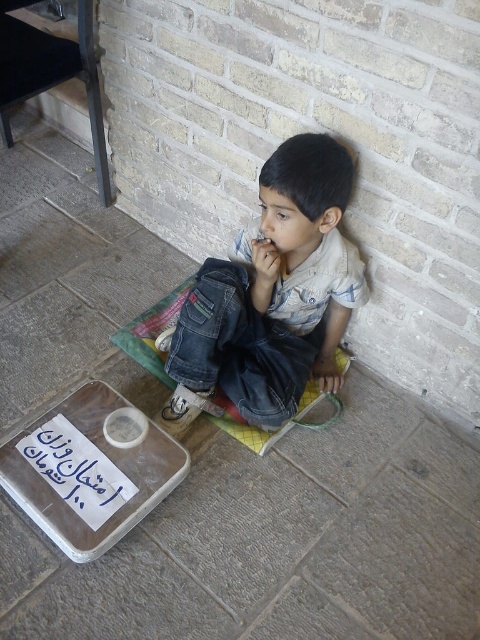
Question: Considering the real-world distances, which object is farthest from the denim jeans at center?

Choices:
 (A) transparent plastic tray at lower left
 (B) green woven mat at center

Answer: (A)

Question: Is transparent plastic tray at lower left below green woven mat at center?

Choices:
 (A) yes
 (B) no

Answer: (A)

Question: Which point is farther to the camera?

Choices:
 (A) transparent plastic tray at lower left
 (B) green woven mat at center
 (C) denim jeans at center

Answer: (B)

Question: Which object appears closest to the camera in this image?

Choices:
 (A) green woven mat at center
 (B) transparent plastic tray at lower left
 (C) denim jeans at center

Answer: (C)

Question: Is denim jeans at center closer to camera compared to green woven mat at center?

Choices:
 (A) no
 (B) yes

Answer: (B)

Question: Can you confirm if transparent plastic tray at lower left is positioned to the left of green woven mat at center?

Choices:
 (A) yes
 (B) no

Answer: (A)